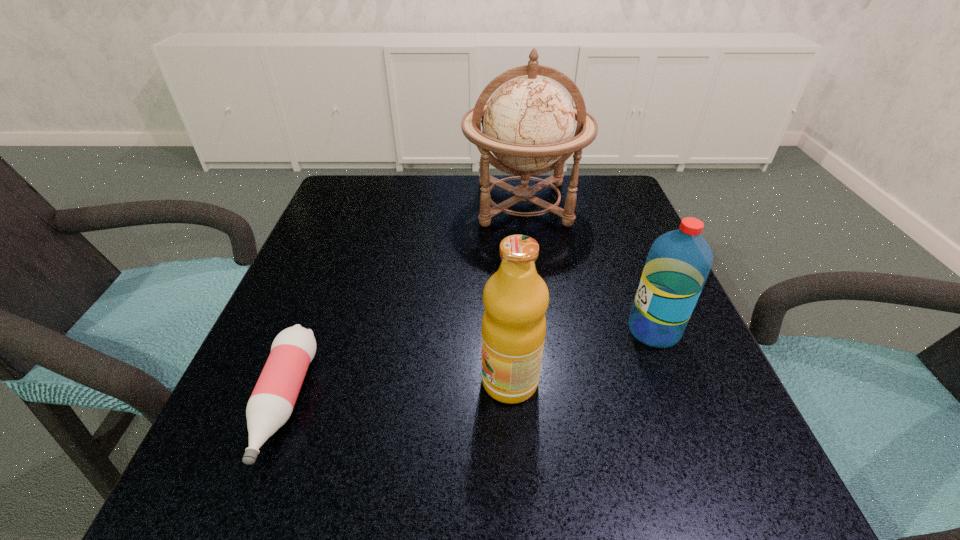
Locate an element on the screen. free area in between the leftmost object and the fruit juice is located at coordinates (397, 392).

Where is `free spot between the shortest object and the third tallest object`? This screenshot has height=540, width=960. free spot between the shortest object and the third tallest object is located at coordinates (469, 366).

You are a GUI agent. You are given a task and a screenshot of the screen. Output one action in this format:
    pyautogui.click(x=<x>, y=<y>)
    Task: Click on the free area in between the water bottle and the fruit juice
    This screenshot has width=960, height=540.
    Given the screenshot: What is the action you would take?
    pyautogui.click(x=582, y=355)

Image resolution: width=960 pixels, height=540 pixels. I want to click on unoccupied position between the shortest object and the farthest object, so [x=404, y=303].

Image resolution: width=960 pixels, height=540 pixels. Identify the location of vacant region between the tallest object and the shortest object. (404, 303).

The height and width of the screenshot is (540, 960). What are the coordinates of `unoccupied area between the fruit juice and the water bottle` in the screenshot? It's located at (582, 355).

The width and height of the screenshot is (960, 540). In order to click on vacant space that is in between the leftmost object and the fruit juice in this screenshot , I will do `click(397, 392)`.

I want to click on free space between the bottle and the second shortest object, so click(469, 366).

The height and width of the screenshot is (540, 960). What are the coordinates of `object that stands as the closest to the third shortest object` in the screenshot? It's located at (679, 261).

Identify the location of object that is the closest to the farthest object. (679, 261).